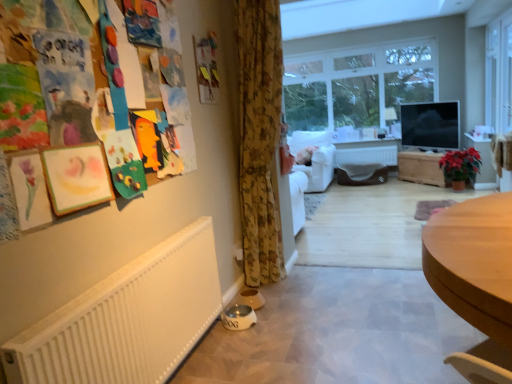
Where is `vacant region under white matte radiator at center (from a real-world perspective)`? The image size is (512, 384). vacant region under white matte radiator at center (from a real-world perspective) is located at coordinates (374, 174).